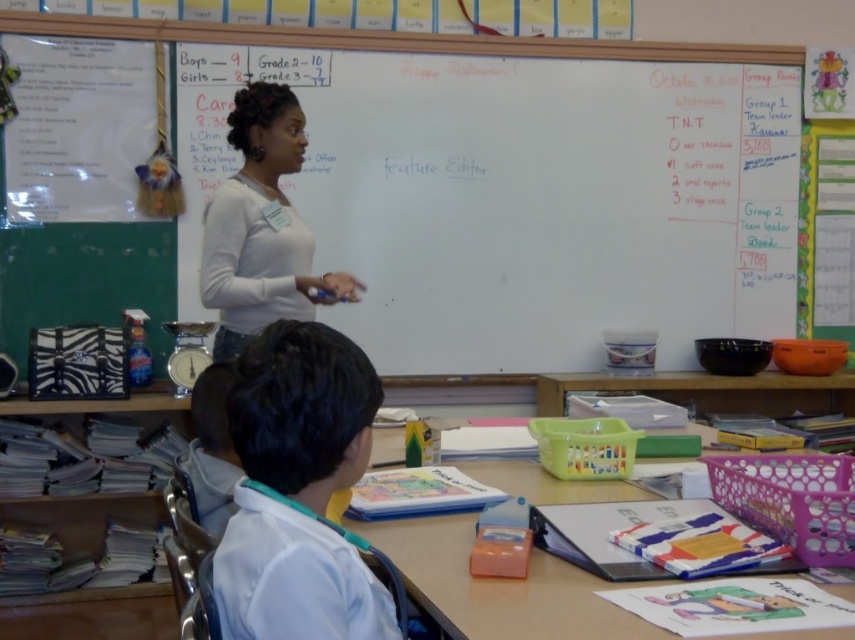
You are a student sitting at the desk in the center of the classroom. You need to reach both the whiteboard at upper center and the white smooth shirt at lower left. Which object is closer to your current position?

The whiteboard at upper center is closer to your current position because it is only 8.97 feet away from the white smooth shirt at lower left, so the whiteboard is nearer than the shirt.

You are a student sitting in the classroom and you see the white smooth shirt at lower left and the white matte shirt at center. Which shirt is shorter in height?

The white smooth shirt at lower left has a lesser height compared to the white matte shirt at center, so the white smooth shirt at lower left is shorter in height.

You are a student sitting at your desk in the classroom. You notice two points marked on the floor. One is at point (600, 144) and the other is at point (311, 576). If you are facing the front of the classroom, which point is closer to the back wall?

Point (600, 144) is behind point (311, 576), so it is closer to the back wall.